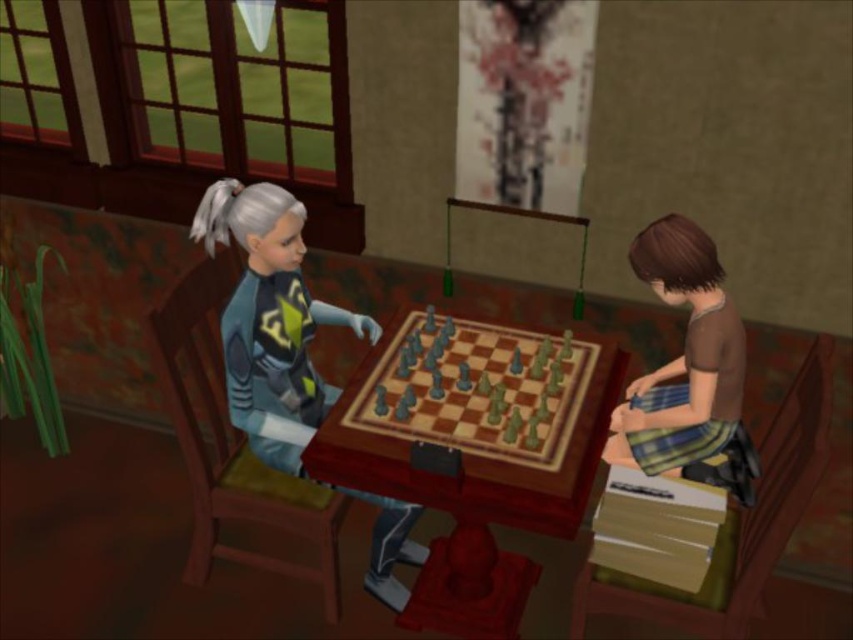
You are a character in the game who wants to place a chess piece between the matte blue jacket at center and the brown fabric shirt at lower right. Can you fit it there?

The distance between the matte blue jacket at center and the brown fabric shirt at lower right is 99.90 centimeters. Since the chess piece is much smaller than this distance, you can easily place it there.

You are a game developer analyzing the layout of the chessboard in the scene. What are the coordinates of the gray plastic chessboard at center?

The gray plastic chessboard at center is located at point (477, 388).